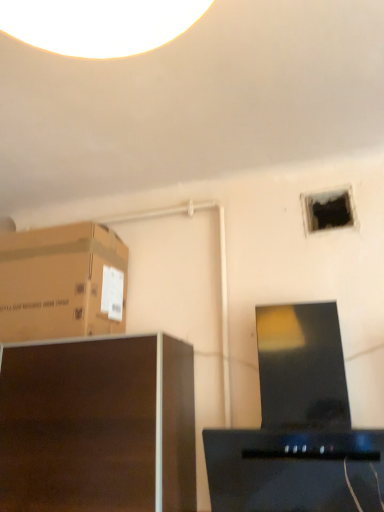
Measure the distance between black matte hole at upper right and camera.

The distance of black matte hole at upper right from camera is 1.44 meters.

You are a GUI agent. You are given a task and a screenshot of the screen. Output one action in this format:
    pyautogui.click(x=<x>, y=<y>)
    Task: Click on the black glossy desktop computer at center
    
    Given the screenshot: What is the action you would take?
    pyautogui.click(x=297, y=425)

Locate an element on the screen. The width and height of the screenshot is (384, 512). brown cardboard box at upper left is located at coordinates (62, 283).

At what (x,y) coordinates should I click in order to perform the action: click on black matte hole at upper right. Please return your answer as a coordinate pair (x, y). Looking at the image, I should click on (329, 211).

Looking at this image, from the image's perspective, is dark wood cabinet at lower left positioned above or below brown cardboard box at upper left?

Clearly, from the image's perspective, dark wood cabinet at lower left is below brown cardboard box at upper left.

Which object is more forward, dark wood cabinet at lower left or brown cardboard box at upper left?

dark wood cabinet at lower left is more forward.

Is dark wood cabinet at lower left taller than brown cardboard box at upper left?

Correct, dark wood cabinet at lower left is much taller as brown cardboard box at upper left.

Does dark wood cabinet at lower left turn towards brown cardboard box at upper left?

No, dark wood cabinet at lower left is not oriented towards brown cardboard box at upper left.

Locate an element on the screen. This screenshot has height=512, width=384. desktop computer that is below the black matte hole at upper right (from the image's perspective) is located at coordinates (297, 425).

Considering the sizes of objects black matte hole at upper right and black glossy desktop computer at center in the image provided, who is taller, black matte hole at upper right or black glossy desktop computer at center?

Standing taller between the two is black glossy desktop computer at center.

Based on their sizes in the image, would you say black matte hole at upper right is bigger or smaller than black glossy desktop computer at center?

Clearly, black matte hole at upper right is smaller in size than black glossy desktop computer at center.

Is black matte hole at upper right wider or thinner than black glossy desktop computer at center?

Clearly, black matte hole at upper right has less width compared to black glossy desktop computer at center.

Between dark wood cabinet at lower left and black matte hole at upper right, which one has larger width?

dark wood cabinet at lower left.

Is dark wood cabinet at lower left oriented away from black matte hole at upper right?

No, dark wood cabinet at lower left is not facing away from black matte hole at upper right.

Is dark wood cabinet at lower left next to black matte hole at upper right?

No, dark wood cabinet at lower left is not next to black matte hole at upper right.

Can you confirm if dark wood cabinet at lower left is smaller than black matte hole at upper right?

Incorrect, dark wood cabinet at lower left is not smaller in size than black matte hole at upper right.

Considering the sizes of objects black glossy desktop computer at center and brown cardboard box at upper left in the image provided, who is smaller, black glossy desktop computer at center or brown cardboard box at upper left?

brown cardboard box at upper left is smaller.

Considering the sizes of objects black glossy desktop computer at center and brown cardboard box at upper left in the image provided, who is shorter, black glossy desktop computer at center or brown cardboard box at upper left?

Standing shorter between the two is brown cardboard box at upper left.

Between black glossy desktop computer at center and brown cardboard box at upper left, which one has smaller width?

black glossy desktop computer at center is thinner.

Is black matte hole at upper right positioned beyond the bounds of dark wood cabinet at lower left?

Yes.

Which is in front, black matte hole at upper right or dark wood cabinet at lower left?

dark wood cabinet at lower left is more forward.

Is black matte hole at upper right next to dark wood cabinet at lower left and touching it?

No, black matte hole at upper right is not with dark wood cabinet at lower left.

In terms of height, does brown cardboard box at upper left look taller or shorter compared to black glossy desktop computer at center?

In the image, brown cardboard box at upper left appears to be shorter than black glossy desktop computer at center.

Considering the relative positions of brown cardboard box at upper left and black glossy desktop computer at center in the image provided, is brown cardboard box at upper left in front of black glossy desktop computer at center?

That is False.

Is brown cardboard box at upper left facing towards black glossy desktop computer at center?

No, brown cardboard box at upper left is not turned towards black glossy desktop computer at center.

From the picture: How many degrees apart are the facing directions of brown cardboard box at upper left and black glossy desktop computer at center?

The facing directions of brown cardboard box at upper left and black glossy desktop computer at center are 1.86 degrees apart.

Where is `cardboard box on the left of dark wood cabinet at lower left`? The width and height of the screenshot is (384, 512). cardboard box on the left of dark wood cabinet at lower left is located at coordinates (62, 283).

Measure the distance from brown cardboard box at upper left to dark wood cabinet at lower left.

brown cardboard box at upper left is 10.53 inches away from dark wood cabinet at lower left.

Is brown cardboard box at upper left positioned with its back to dark wood cabinet at lower left?

brown cardboard box at upper left is not turned away from dark wood cabinet at lower left.

Find the location of `cardboard box above the dark wood cabinet at lower left (from a real-world perspective)`. cardboard box above the dark wood cabinet at lower left (from a real-world perspective) is located at coordinates (62, 283).

Find the location of a particular element. This screenshot has width=384, height=512. hole located behind the black glossy desktop computer at center is located at coordinates (329, 211).

Which object lies further to the anchor point dark wood cabinet at lower left, black matte hole at upper right or brown cardboard box at upper left?

Among the two, black matte hole at upper right is located further to dark wood cabinet at lower left.

From the picture: Which object lies further to the anchor point dark wood cabinet at lower left, black glossy desktop computer at center or black matte hole at upper right?

black matte hole at upper right.

From the picture: When comparing their distances from black matte hole at upper right, does black glossy desktop computer at center or dark wood cabinet at lower left seem closer?

black glossy desktop computer at center.

When comparing their distances from black glossy desktop computer at center, does dark wood cabinet at lower left or brown cardboard box at upper left seem further?

Among the two, brown cardboard box at upper left is located further to black glossy desktop computer at center.

In the scene shown: Estimate the real-world distances between objects in this image. Which object is further from brown cardboard box at upper left, dark wood cabinet at lower left or black matte hole at upper right?

Based on the image, black matte hole at upper right appears to be further to brown cardboard box at upper left.

Looking at the image, which one is located further to brown cardboard box at upper left, black matte hole at upper right or dark wood cabinet at lower left?

Based on the image, black matte hole at upper right appears to be further to brown cardboard box at upper left.

When comparing their distances from dark wood cabinet at lower left, does brown cardboard box at upper left or black matte hole at upper right seem closer?

The object closer to dark wood cabinet at lower left is brown cardboard box at upper left.

Estimate the real-world distances between objects in this image. Which object is further from brown cardboard box at upper left, black glossy desktop computer at center or black matte hole at upper right?

A: The object further to brown cardboard box at upper left is black matte hole at upper right.

You are a GUI agent. You are given a task and a screenshot of the screen. Output one action in this format:
    pyautogui.click(x=<x>, y=<y>)
    Task: Click on the furniture between brown cardboard box at upper left and black glossy desktop computer at center
    
    Given the screenshot: What is the action you would take?
    pyautogui.click(x=97, y=426)

I want to click on furniture situated between brown cardboard box at upper left and black matte hole at upper right from left to right, so click(97, 426).

Where is `desktop computer between dark wood cabinet at lower left and black matte hole at upper right from left to right`? The width and height of the screenshot is (384, 512). desktop computer between dark wood cabinet at lower left and black matte hole at upper right from left to right is located at coordinates (297, 425).

The width and height of the screenshot is (384, 512). Find the location of `desktop computer situated between brown cardboard box at upper left and black matte hole at upper right from left to right`. desktop computer situated between brown cardboard box at upper left and black matte hole at upper right from left to right is located at coordinates (297, 425).